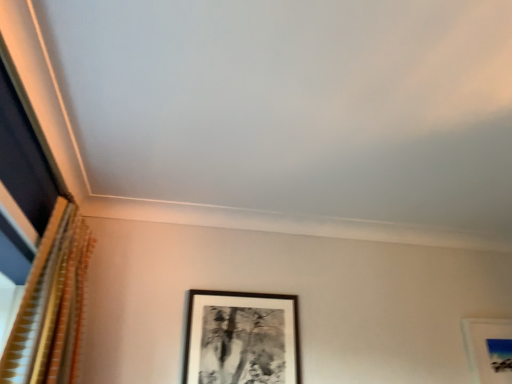
Question: Would you say gold textured curtain at left is to the left or to the right of black matte picture frame at center in the picture?

Choices:
 (A) right
 (B) left

Answer: (B)

Question: Considering their positions, is gold textured curtain at left located in front of or behind black matte picture frame at center?

Choices:
 (A) behind
 (B) front

Answer: (B)

Question: From a real-world perspective, is gold textured curtain at left positioned above or below black matte picture frame at center?

Choices:
 (A) below
 (B) above

Answer: (B)

Question: In terms of height, does black matte picture frame at center look taller or shorter compared to gold textured curtain at left?

Choices:
 (A) short
 (B) tall

Answer: (A)

Question: Looking at their shapes, would you say black matte picture frame at center is wider or thinner than gold textured curtain at left?

Choices:
 (A) wide
 (B) thin

Answer: (B)

Question: Considering their positions, is black matte picture frame at center located in front of or behind gold textured curtain at left?

Choices:
 (A) behind
 (B) front

Answer: (A)

Question: Is black matte picture frame at center bigger or smaller than gold textured curtain at left?

Choices:
 (A) big
 (B) small

Answer: (B)